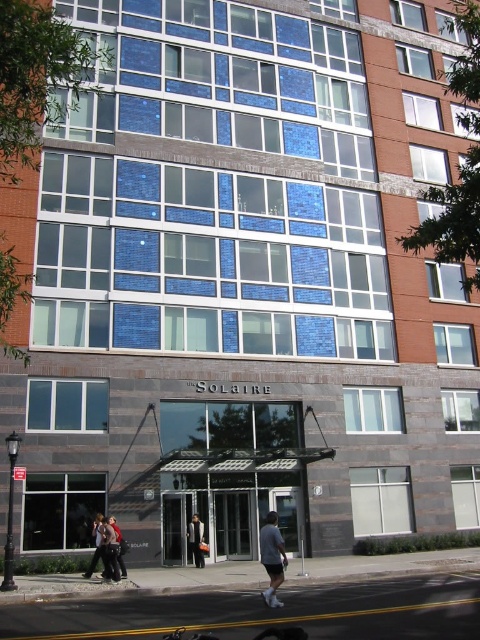
You are standing in front of THE SOLAIRE building and want to determine the relative positions of two points marked on its facade. Which point is closer to you, point at coordinate (268, 512) or point at coordinate (110, 568)?

Point at coordinate (110, 568) is closer to you because it is less further to the viewer than point at coordinate (268, 512).

You are trying to decide which clothing item to take from the rack. The gray cotton shirt at center and the dark gray fabric jacket at lower center are both on the same rack. Which item is wider?

The gray cotton shirt at center is wider than the dark gray fabric jacket at lower center.

You are standing in front of the building and see the gray asphalt at lower center and the dark gray fabric jacket at lower center. Which one covers a bigger area on the ground?

The gray asphalt at lower center is larger in size than the dark gray fabric jacket at lower center, so it covers a bigger area on the ground.